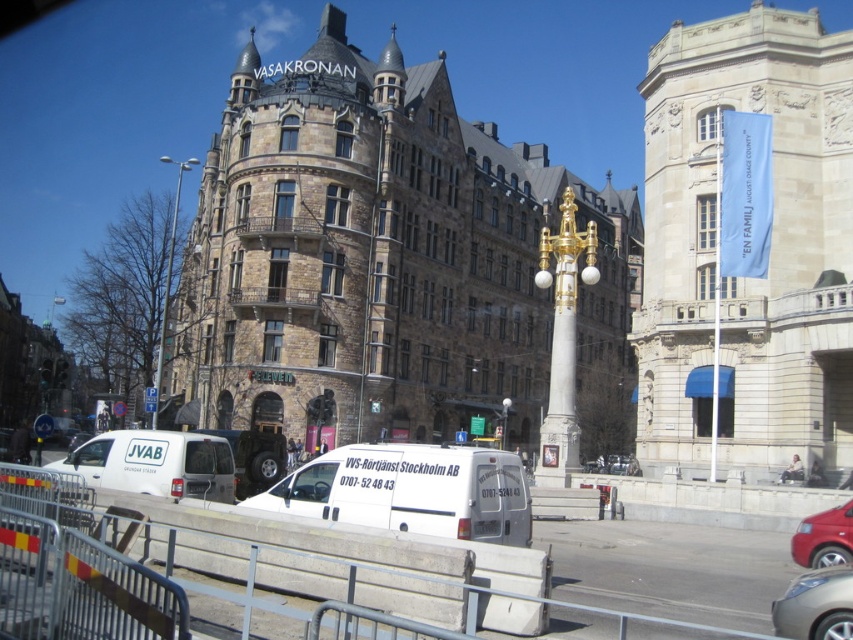
You are a pedestrian standing at the barricade near the white van. You need to cross the street to reach the Gothic Revival building. Which car, the shiny red car at lower right or the metallic silver car at center, is closer to the barricade?

The metallic silver car at center is closer to the barricade because the shiny red car at lower right is positioned to its right, meaning it is further away from the barricade.